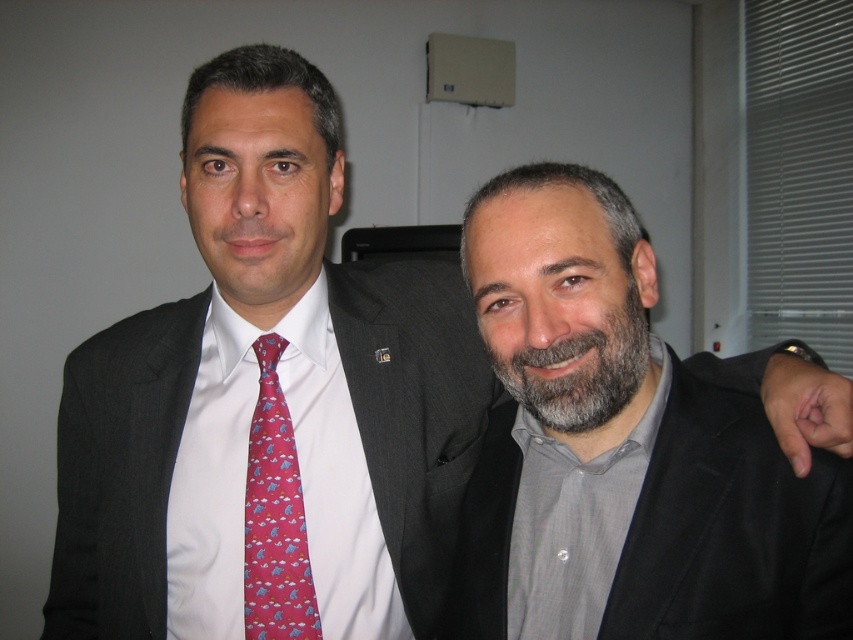
Which of these two, gray matte suit at right or grayhairbeard at center, stands shorter?

grayhairbeard at center is shorter.

Between gray matte suit at right and grayhairbeard at center, which one is positioned higher?

grayhairbeard at center is higher up.

Is point (636, 275) farther from camera compared to point (502, 358)?

Yes, it is.

In order to click on gray matte suit at right in this screenshot , I will do `click(624, 449)`.

Which is above, gray matte suit at right or pink silk tie at left?

gray matte suit at right is above.

Is point (763, 621) positioned in front of point (285, 611)?

Yes, point (763, 621) is closer to viewer.

Identify the location of gray matte suit at right. (624, 449).

Measure the distance from pink silk tie at left to grayhairbeard at center.

A distance of 11.91 inches exists between pink silk tie at left and grayhairbeard at center.

Based on the photo, between pink silk tie at left and grayhairbeard at center, which one has less height?

grayhairbeard at center is shorter.

Identify the location of pink silk tie at left. (276, 516).